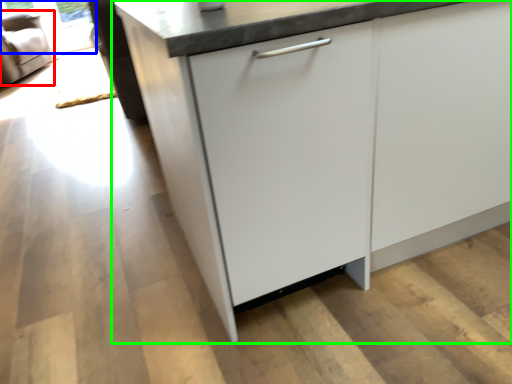
Question: Which object is positioned closest to armchair (highlighted by a red box)? Select from window screen (highlighted by a blue box) and cabinetry (highlighted by a green box).

Choices:
 (A) window screen
 (B) cabinetry

Answer: (A)